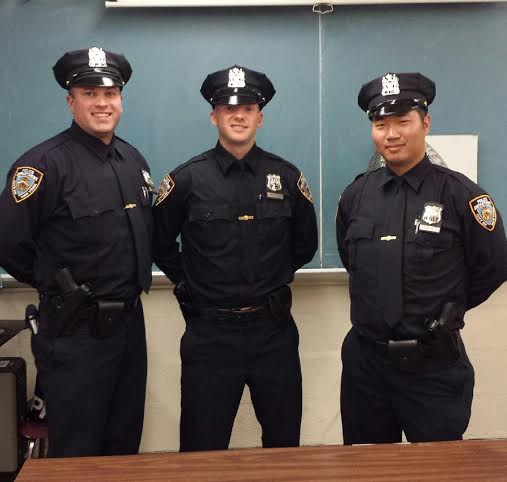
Image resolution: width=507 pixels, height=482 pixels. I want to click on green chalk board, so click(x=187, y=118).